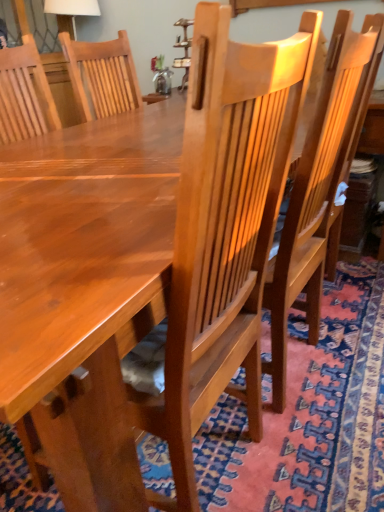
Question: Is carpeted floor at center situated inside glossy wood chair at center or outside?

Choices:
 (A) outside
 (B) inside

Answer: (A)

Question: In terms of size, does carpeted floor at center appear bigger or smaller than glossy wood chair at center?

Choices:
 (A) big
 (B) small

Answer: (A)

Question: Is carpeted floor at center in front of or behind glossy wood chair at center in the image?

Choices:
 (A) front
 (B) behind

Answer: (A)

Question: Is glossy wood chair at center in front of or behind carpeted floor at center in the image?

Choices:
 (A) behind
 (B) front

Answer: (A)

Question: From the image's perspective, is glossy wood chair at center positioned above or below carpeted floor at center?

Choices:
 (A) below
 (B) above

Answer: (B)

Question: Is glossy wood chair at center wider or thinner than carpeted floor at center?

Choices:
 (A) wide
 (B) thin

Answer: (B)

Question: Considering the positions of point [x=317, y=251] and point [x=215, y=507], is point [x=317, y=251] closer or farther from the camera than point [x=215, y=507]?

Choices:
 (A) farther
 (B) closer

Answer: (A)